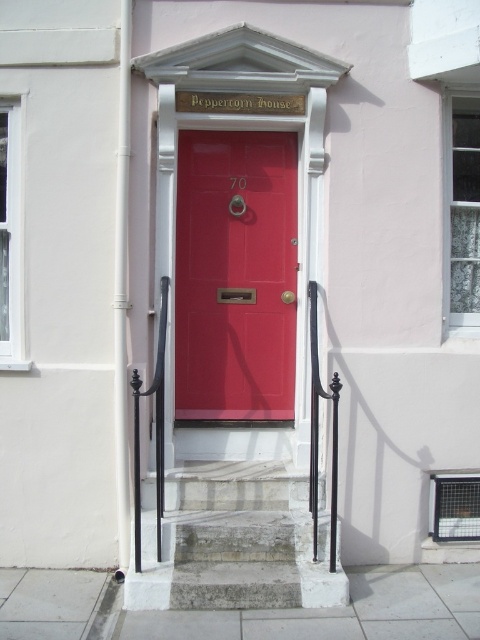
You are a delivery person trying to park your van near the matte red door at center. The van requires a space larger than the area occupied by the gray stone stairs at center. Is there enough space available?

The matte red door at center occupies less space than gray stone stairs at center, so the available space might be sufficient for the van if it is larger than the gray stone stairs at center. However, without knowing the exact dimensions of the van and the space, it is difficult to confirm. Please check the parking area for designated spots or signage.

You are standing at the entrance of Peppercorn House and want to go upstairs. There is a matte red door at center and gray stone stairs at center. Which one is closer to you?

The matte red door at center is closer to you since it is positioned further to the viewer than the gray stone stairs at center.